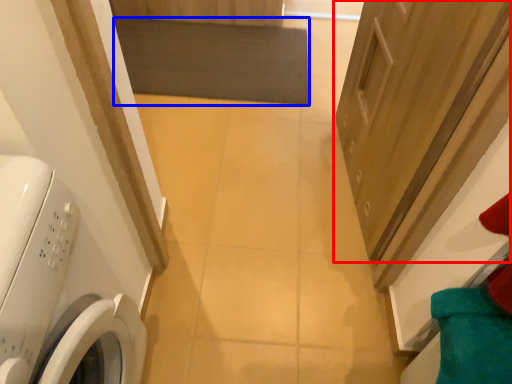
Question: Which object appears closest to the camera in this image, door (highlighted by a red box) or mat (highlighted by a blue box)?

Choices:
 (A) door
 (B) mat

Answer: (A)